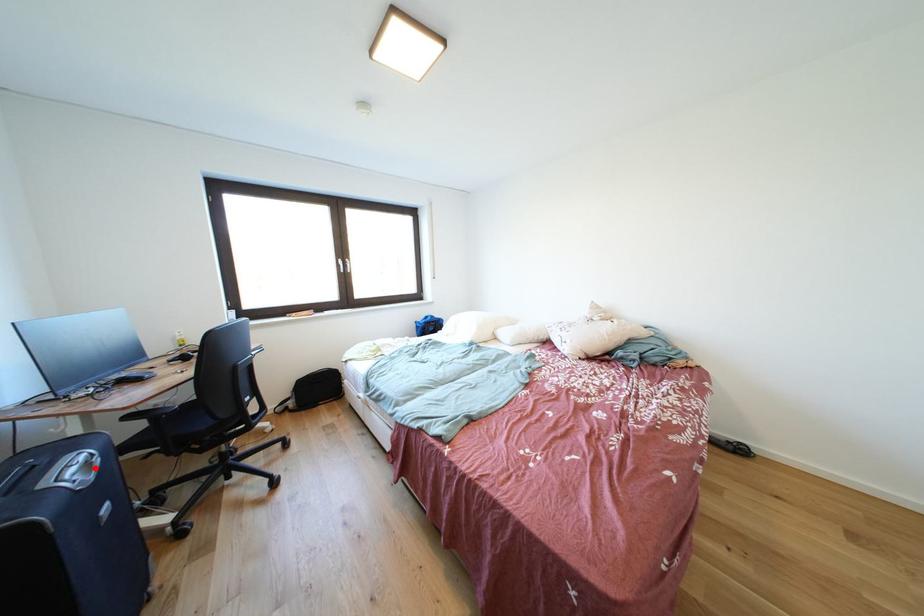
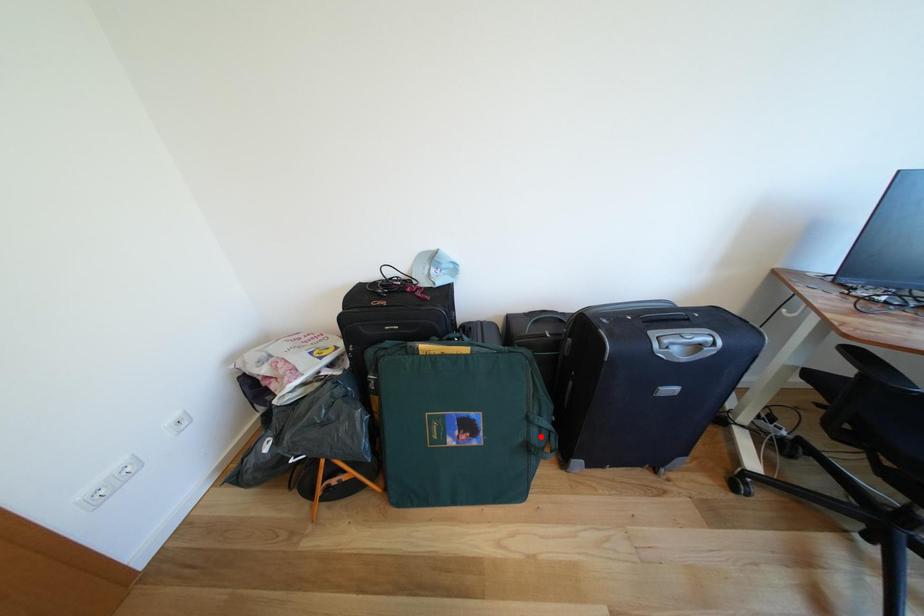
I am providing you with two images of the same scene from different viewpoints. A red point is marked on the first image and another point is marked on the second image. Does the point marked in image1 correspond to the same location as the one in image2?

No